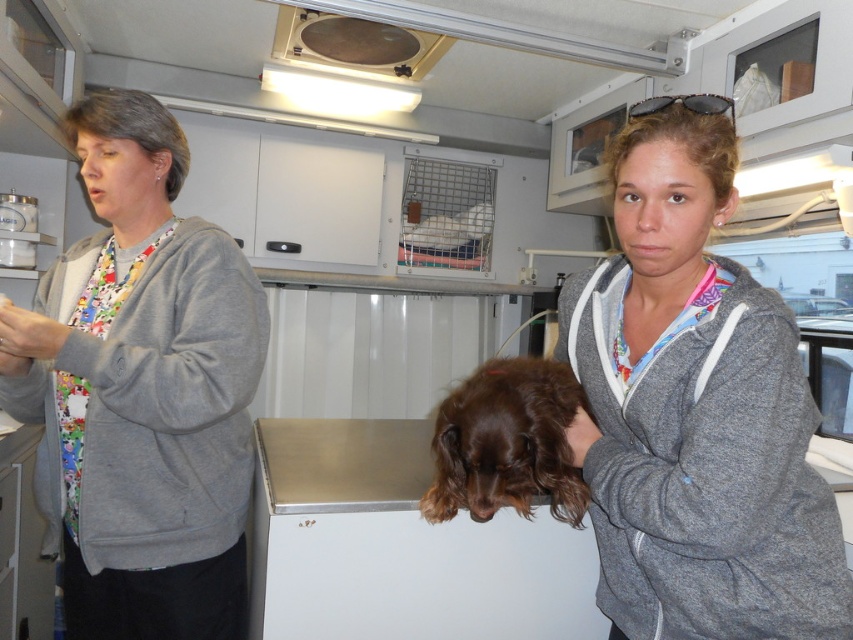
Can you confirm if gray fleece jacket at left is taller than matte black goggles at upper center?

Yes.

Does gray fleece jacket at left appear under matte black goggles at upper center?

Yes.

The width and height of the screenshot is (853, 640). I want to click on gray fleece jacket at left, so click(141, 388).

What do you see at coordinates (695, 412) in the screenshot? I see `gray fleece jacket at center` at bounding box center [695, 412].

Is point (711, 401) less distant than point (193, 536)?

Yes, it is in front of point (193, 536).

Find the location of a particular element. gray fleece jacket at center is located at coordinates (695, 412).

Identify the location of gray fleece jacket at center. (695, 412).

What are the coordinates of `gray fleece jacket at center` in the screenshot? It's located at (695, 412).